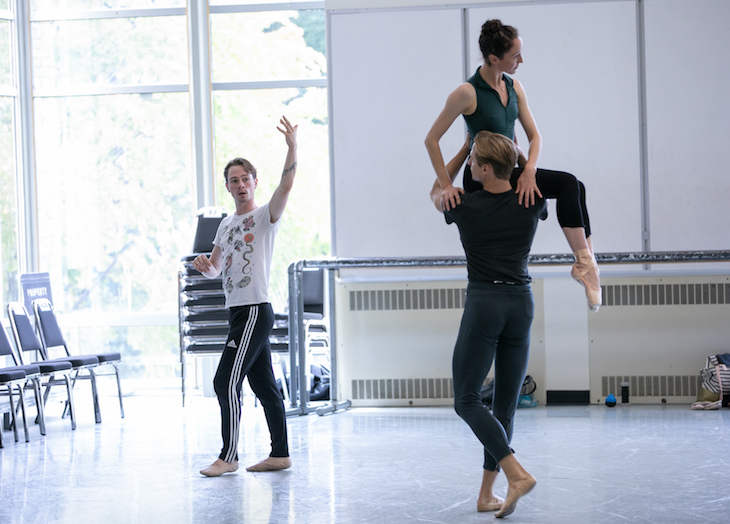
This screenshot has height=524, width=730. I want to click on chairs set out where you sit, so click(9, 378), click(28, 370), click(55, 367), click(82, 364), click(106, 359).